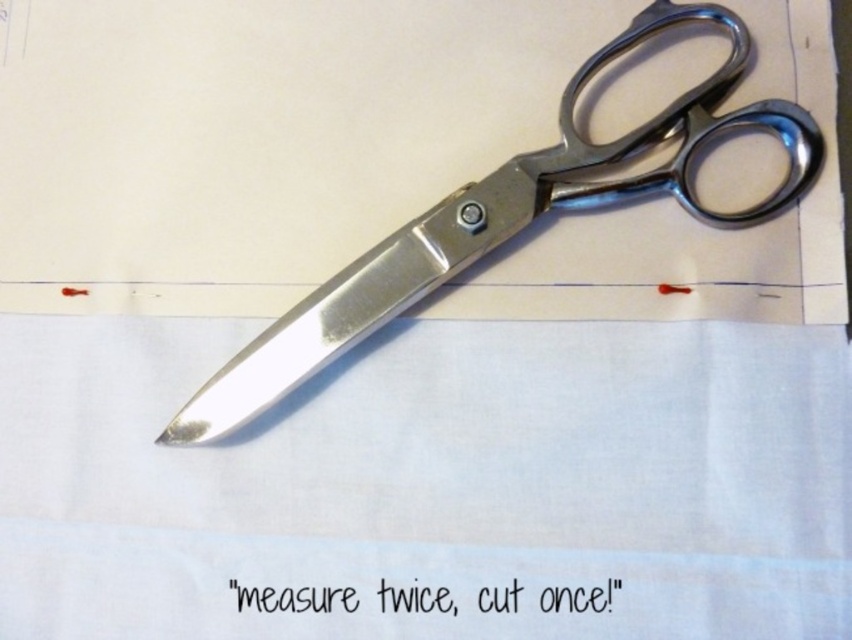
Question: Does white fabric at center appear on the left side of polished metal scissors at center?

Choices:
 (A) no
 (B) yes

Answer: (B)

Question: Is white fabric at center bigger than polished metal scissors at center?

Choices:
 (A) no
 (B) yes

Answer: (B)

Question: Does white fabric at center appear over polished metal scissors at center?

Choices:
 (A) yes
 (B) no

Answer: (B)

Question: Which point is closer to the camera?

Choices:
 (A) white fabric at center
 (B) polished metal scissors at center

Answer: (A)

Question: Which point is closer to the camera taking this photo?

Choices:
 (A) (481, 240)
 (B) (709, 435)

Answer: (B)